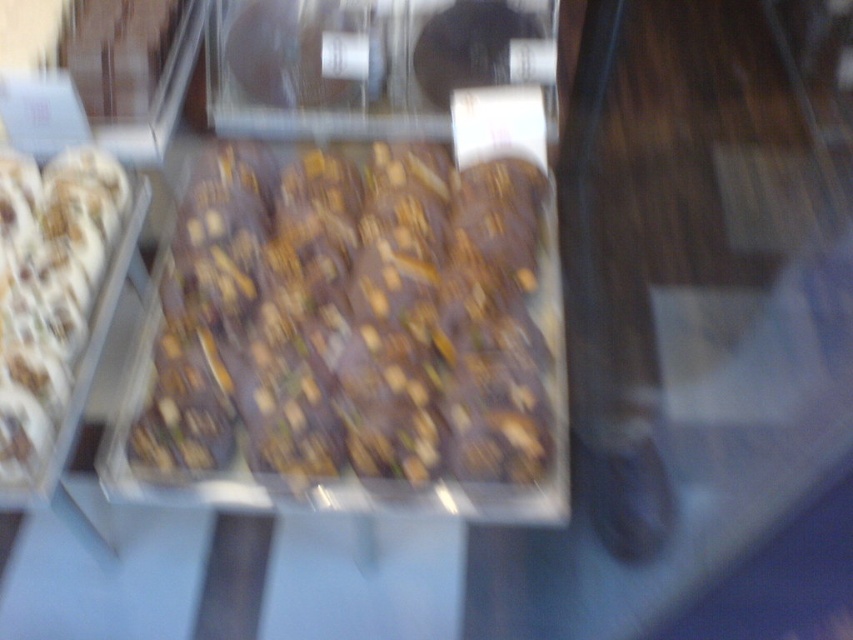
Is point (258, 397) in front of point (18, 250)?

Yes.

Does dark chocolate bar at center appear on the left side of white frosted donut at left?

Incorrect, dark chocolate bar at center is not on the left side of white frosted donut at left.

Find the location of a particular element. dark chocolate bar at center is located at coordinates (352, 332).

Identify the location of dark chocolate bar at center. The height and width of the screenshot is (640, 853). (352, 332).